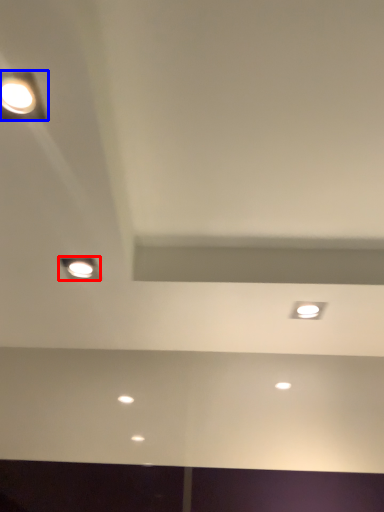
Question: Which point is closer to the camera, lamp (highlighted by a red box) or lamp (highlighted by a blue box)?

Choices:
 (A) lamp
 (B) lamp

Answer: (B)